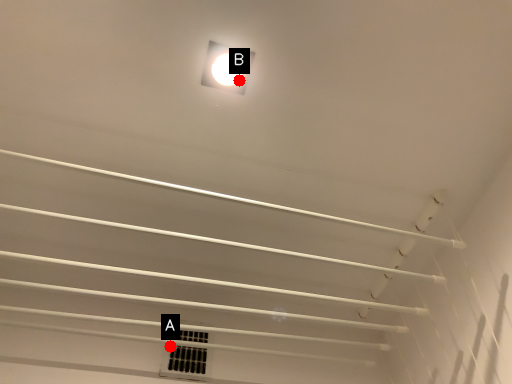
Question: Two points are circled on the image, labeled by A and B beside each circle. Which point appears closest to the camera in this image?

Choices:
 (A) A is closer
 (B) B is closer

Answer: (B)